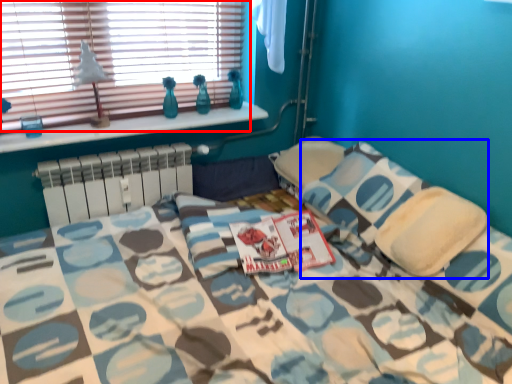
Question: Which object appears closest to the camera in this image, window (highlighted by a red box) or pillow (highlighted by a blue box)?

Choices:
 (A) window
 (B) pillow

Answer: (B)